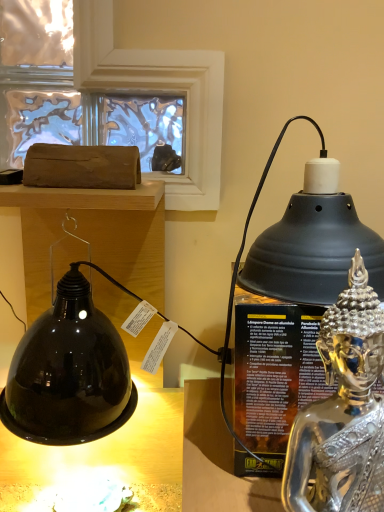
Where is `shiny metallic oil lamp at right`? This screenshot has height=512, width=384. shiny metallic oil lamp at right is located at coordinates (245, 241).

Is matte brown log at upper left inside or outside of silver metallic statue at right?

matte brown log at upper left lies outside silver metallic statue at right.

Based on their sizes in the image, would you say matte brown log at upper left is bigger or smaller than silver metallic statue at right?

Considering their sizes, matte brown log at upper left takes up more space than silver metallic statue at right.

How different are the orientations of matte brown log at upper left and silver metallic statue at right in degrees?

They differ by 2.41 degrees in their facing directions.

Looking at this image, is silver metallic statue at right at the back of matte brown log at upper left?

No, matte brown log at upper left's orientation is not away from silver metallic statue at right.

From a real-world perspective, between matte brown log at upper left and shiny metallic oil lamp at right, who is vertically higher?

matte brown log at upper left is physically above.

Which of these two, matte brown log at upper left or shiny metallic oil lamp at right, is bigger?

With larger size is matte brown log at upper left.

Is matte brown log at upper left completely or partially outside of shiny metallic oil lamp at right?

Indeed, matte brown log at upper left is completely outside shiny metallic oil lamp at right.

Is shiny metallic oil lamp at right at the left side of matte brown log at upper left?

No.

From the image's perspective, between shiny metallic oil lamp at right and matte brown log at upper left, who is located below?

shiny metallic oil lamp at right, from the image's perspective.

Measure the distance between shiny metallic oil lamp at right and matte brown log at upper left.

shiny metallic oil lamp at right and matte brown log at upper left are 9.26 inches apart.

From a real-world perspective, is silver metallic statue at right located higher than matte brown log at upper left?

No, from a real-world perspective, silver metallic statue at right is not on top of matte brown log at upper left.

Considering the relative positions of silver metallic statue at right and matte brown log at upper left in the image provided, is silver metallic statue at right to the left or to the right of matte brown log at upper left?

From the image, it's evident that silver metallic statue at right is to the right of matte brown log at upper left.

Is silver metallic statue at right oriented away from matte brown log at upper left?

silver metallic statue at right does not have its back to matte brown log at upper left.

How different are the orientations of silver metallic statue at right and matte brown log at upper left in degrees?

The angle between the facing direction of silver metallic statue at right and the facing direction of matte brown log at upper left is 2.41 degrees.

Is shiny metallic oil lamp at right wider than silver metallic statue at right?

Correct, the width of shiny metallic oil lamp at right exceeds that of silver metallic statue at right.

Does shiny metallic oil lamp at right touch silver metallic statue at right?

shiny metallic oil lamp at right and silver metallic statue at right are clearly separated.

How different are the orientations of shiny metallic oil lamp at right and silver metallic statue at right in degrees?

There is a 3.13-degree angle between the facing directions of shiny metallic oil lamp at right and silver metallic statue at right.

Choose the correct answer: Is silver metallic statue at right inside shiny metallic oil lamp at right or outside it?

silver metallic statue at right cannot be found inside shiny metallic oil lamp at right.

In the image, is silver metallic statue at right positioned in front of or behind shiny metallic oil lamp at right?

Clearly, silver metallic statue at right is in front of shiny metallic oil lamp at right.

Is shiny metallic oil lamp at right at the back of silver metallic statue at right?

That's right, silver metallic statue at right is facing away from shiny metallic oil lamp at right.

This screenshot has width=384, height=512. I want to click on person that appears in front of the matte brown log at upper left, so (x=343, y=411).

This screenshot has height=512, width=384. Find the location of `furniture above the shiny metallic oil lamp at right (from the image's perspective)`. furniture above the shiny metallic oil lamp at right (from the image's perspective) is located at coordinates (92, 236).

From the image, which object appears to be nearer to shiny metallic oil lamp at right, silver metallic statue at right or matte brown log at upper left?

silver metallic statue at right.

When comparing their distances from silver metallic statue at right, does matte brown log at upper left or shiny metallic oil lamp at right seem further?

matte brown log at upper left is positioned further to the anchor silver metallic statue at right.

Considering their positions, is silver metallic statue at right positioned further to matte brown log at upper left than shiny metallic oil lamp at right?

Based on the image, silver metallic statue at right appears to be further to matte brown log at upper left.

From the picture: Which object lies nearer to the anchor point shiny metallic oil lamp at right, matte brown log at upper left or silver metallic statue at right?

silver metallic statue at right lies closer to shiny metallic oil lamp at right than the other object.

Estimate the real-world distances between objects in this image. Which object is further from matte brown log at upper left, shiny metallic oil lamp at right or silver metallic statue at right?

silver metallic statue at right is positioned further to the anchor matte brown log at upper left.

Considering their positions, is shiny metallic oil lamp at right positioned further to silver metallic statue at right than matte brown log at upper left?

Among the two, matte brown log at upper left is located further to silver metallic statue at right.

The height and width of the screenshot is (512, 384). What are the coordinates of `person located between matte brown log at upper left and shiny metallic oil lamp at right in the left-right direction` in the screenshot? It's located at pyautogui.click(x=343, y=411).